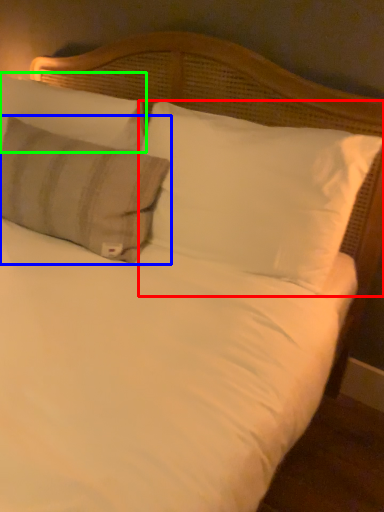
Question: Which is nearer to the pillow (highlighted by a red box)? pillow (highlighted by a blue box) or pillow (highlighted by a green box).

Choices:
 (A) pillow
 (B) pillow

Answer: (A)